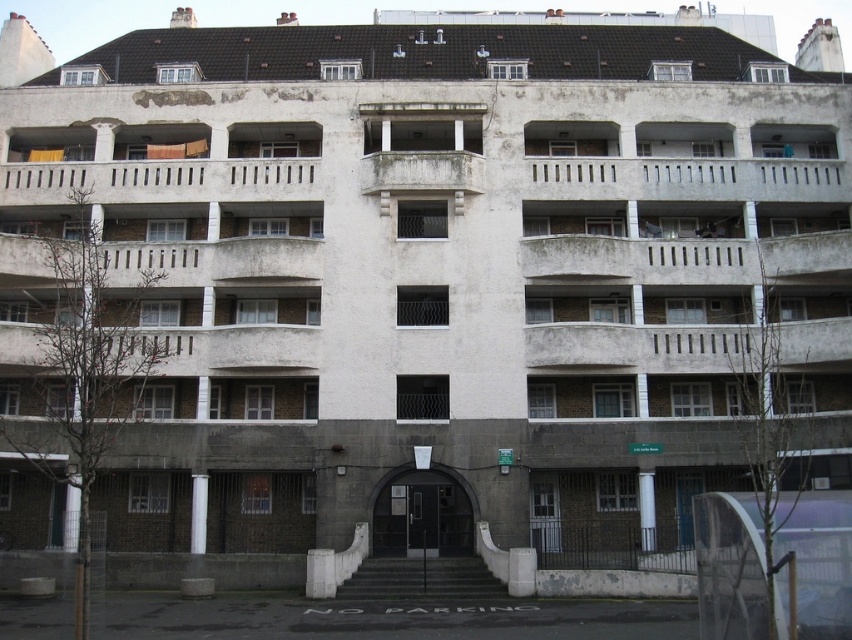
Between white concrete balcony at center and white concrete balcony at upper center, which one has less height?

white concrete balcony at center

Between point (142, 182) and point (669, 173), which one is positioned in front?

Positioned in front is point (669, 173).

The image size is (852, 640). What do you see at coordinates (159, 177) in the screenshot?
I see `white concrete balcony at center` at bounding box center [159, 177].

The image size is (852, 640). Find the location of `white concrete balcony at center`. white concrete balcony at center is located at coordinates tap(159, 177).

Can you confirm if white concrete balcony at upper center is smaller than dark gray concrete stairs at center?

No.

Can you confirm if white concrete balcony at upper center is taller than dark gray concrete stairs at center?

Correct, white concrete balcony at upper center is much taller as dark gray concrete stairs at center.

Who is more forward, (602,182) or (387,563)?

Point (387,563)

Locate an element on the screen. This screenshot has height=640, width=852. white concrete balcony at upper center is located at coordinates (688, 172).

Identify the location of white concrete balcony at center. The height and width of the screenshot is (640, 852). (159, 177).

Who is higher up, white concrete balcony at center or dark gray concrete stairs at center?

white concrete balcony at center is higher up.

Is point (14, 182) farther from viewer compared to point (390, 593)?

Yes, it is behind point (390, 593).

In order to click on white concrete balcony at center in this screenshot , I will do `click(159, 177)`.